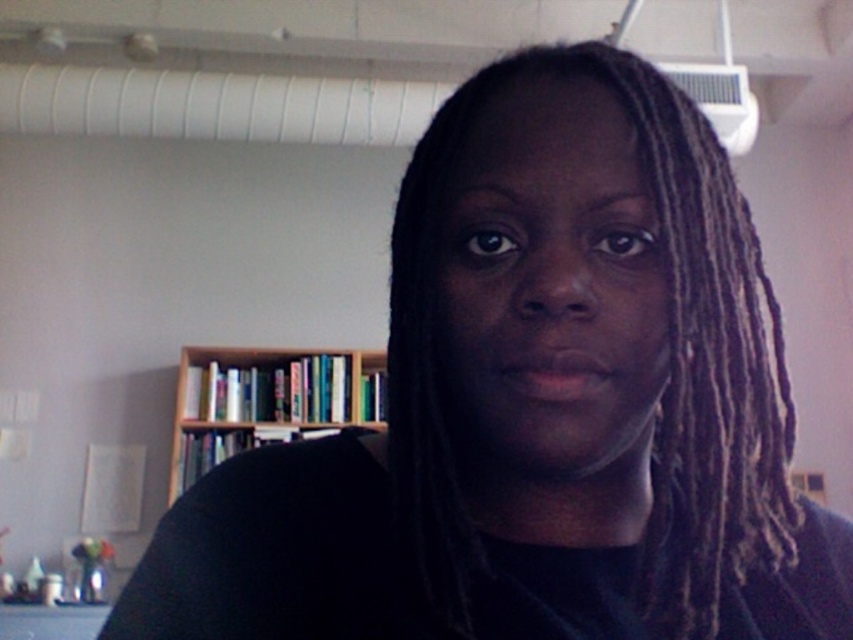
You are standing in a room with a bookshelf and an air conditioning unit. There is a point marked at coordinates (x=670, y=360). What does this point indicate?

The point at coordinates (x=670, y=360) marks the location of the brown dry dreadlocks at center.